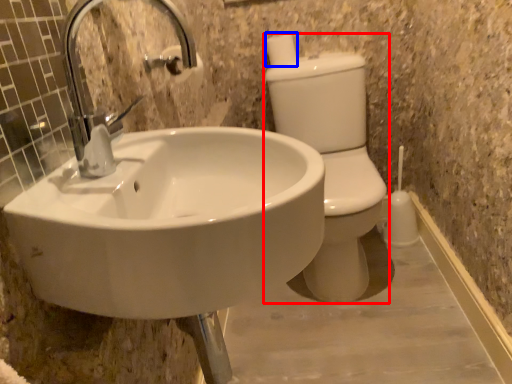
Question: Which point is closer to the camera, toilet bowl (highlighted by a red box) or toilet paper (highlighted by a blue box)?

Choices:
 (A) toilet bowl
 (B) toilet paper

Answer: (A)